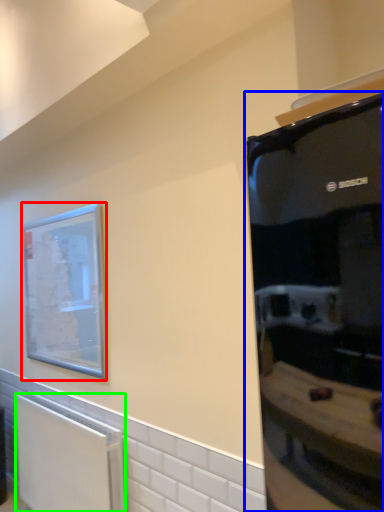
Question: Based on their relative distances, which object is nearer to picture frame (highlighted by a red box)? Choose from appliance (highlighted by a blue box) and radiator (highlighted by a green box).

Choices:
 (A) appliance
 (B) radiator

Answer: (B)